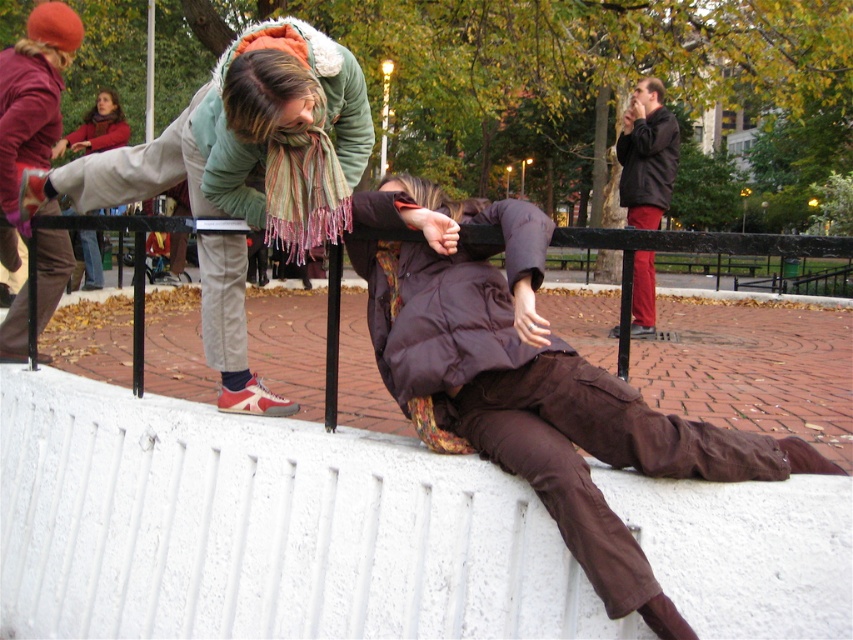
Question: Which point appears farthest from the camera in this image?

Choices:
 (A) (337, 109)
 (B) (83, 236)
 (C) (641, 134)
 (D) (624, 410)

Answer: (B)

Question: Is brown matte jacket at center in front of dark brown leather jacket at upper right?

Choices:
 (A) no
 (B) yes

Answer: (B)

Question: Does green fleece jacket at upper center have a smaller size compared to dark brown leather jacket at upper right?

Choices:
 (A) yes
 (B) no

Answer: (B)

Question: Which object is positioned farthest from the dark brown leather jacket at upper right?

Choices:
 (A) brown matte jacket at center
 (B) matte green jacket at upper left
 (C) green fleece jacket at upper center

Answer: (B)

Question: Among these objects, which one is farthest from the camera?

Choices:
 (A) matte green jacket at upper left
 (B) dark brown leather jacket at upper right

Answer: (A)

Question: Can you confirm if green fleece jacket at upper center is wider than dark brown leather jacket at upper right?

Choices:
 (A) no
 (B) yes

Answer: (B)